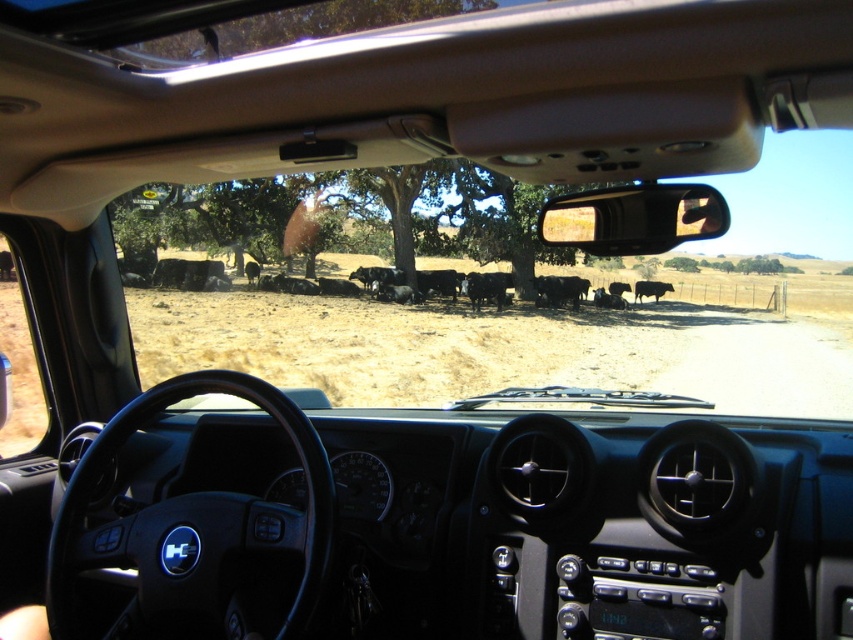
Question: Does black matte cows at center have a greater width compared to black glossy cow at center?

Choices:
 (A) yes
 (B) no

Answer: (A)

Question: Does black matte cows at center appear on the left side of green leafy tree at upper center?

Choices:
 (A) yes
 (B) no

Answer: (B)

Question: Does transparent glass window at lower left come in front of black glossy cow at center?

Choices:
 (A) no
 (B) yes

Answer: (B)

Question: Which object is farther from the camera taking this photo?

Choices:
 (A) transparent glass window at lower left
 (B) black matte cows at center

Answer: (A)

Question: Which of the following is the closest to the observer?

Choices:
 (A) (474, 8)
 (B) (654, 285)
 (C) (22, 362)
 (D) (434, 378)

Answer: (A)

Question: Which of the following is the closest to the observer?

Choices:
 (A) [x=666, y=310]
 (B) [x=15, y=426]

Answer: (B)